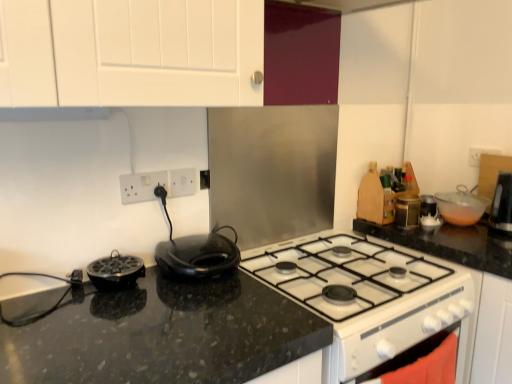
Identify the location of vacant area located to the right-hand side of white frosted glass jar at upper right. [459, 230].